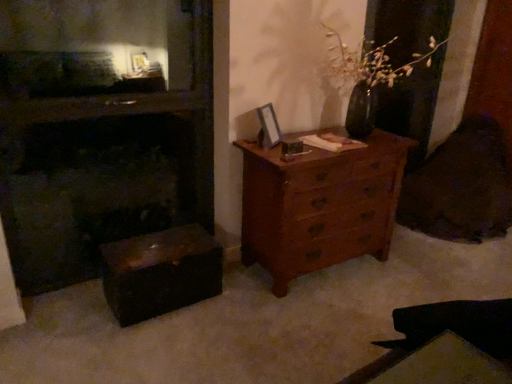
Question: From the image's perspective, is wooden chest of drawers at right located above shiny dark wood trunk at lower left?

Choices:
 (A) no
 (B) yes

Answer: (B)

Question: Is wooden chest of drawers at right behind shiny dark wood trunk at lower left?

Choices:
 (A) no
 (B) yes

Answer: (B)

Question: From a real-world perspective, is wooden chest of drawers at right positioned over shiny dark wood trunk at lower left based on gravity?

Choices:
 (A) no
 (B) yes

Answer: (B)

Question: Could you tell me if wooden chest of drawers at right is turned towards shiny dark wood trunk at lower left?

Choices:
 (A) yes
 (B) no

Answer: (B)

Question: Is wooden chest of drawers at right outside shiny dark wood trunk at lower left?

Choices:
 (A) yes
 (B) no

Answer: (A)

Question: Is wooden chest of drawers at right directly adjacent to shiny dark wood trunk at lower left?

Choices:
 (A) no
 (B) yes

Answer: (A)

Question: From a real-world perspective, is dark wood fireplace at left positioned under wooden picture frame at upper center based on gravity?

Choices:
 (A) yes
 (B) no

Answer: (A)

Question: From the image's perspective, is dark wood fireplace at left on top of wooden picture frame at upper center?

Choices:
 (A) no
 (B) yes

Answer: (A)

Question: Is dark wood fireplace at left far from wooden picture frame at upper center?

Choices:
 (A) yes
 (B) no

Answer: (A)

Question: Is wooden picture frame at upper center at the back of dark wood fireplace at left?

Choices:
 (A) no
 (B) yes

Answer: (A)

Question: Is dark wood fireplace at left shorter than wooden picture frame at upper center?

Choices:
 (A) no
 (B) yes

Answer: (A)

Question: Is dark wood fireplace at left facing towards wooden picture frame at upper center?

Choices:
 (A) no
 (B) yes

Answer: (A)

Question: Considering the relative sizes of shiny dark wood trunk at lower left and wooden picture frame at upper center in the image provided, is shiny dark wood trunk at lower left thinner than wooden picture frame at upper center?

Choices:
 (A) no
 (B) yes

Answer: (A)